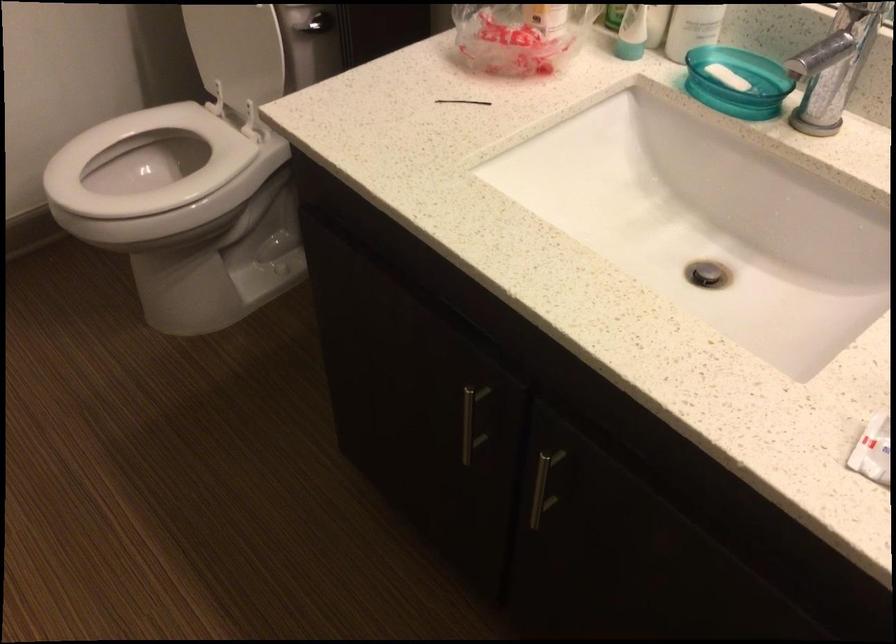
Find where to push the white toilet seat. Please return your answer as a coordinate pair (x, y).

(144, 163)